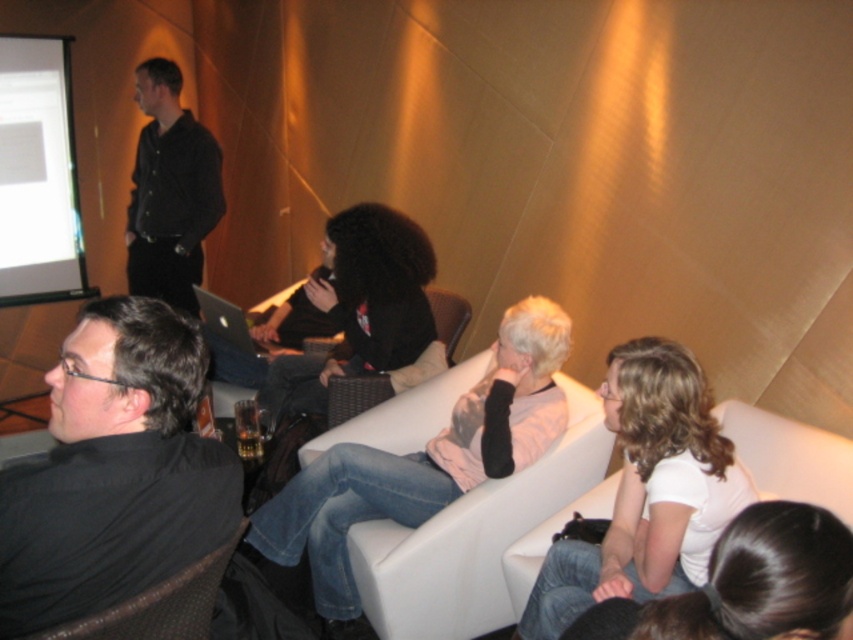
Can you confirm if black matte shirt at lower left is positioned to the right of black matte shirt at center?

In fact, black matte shirt at lower left is to the left of black matte shirt at center.

Which is in front, point (57, 540) or point (364, 273)?

Point (57, 540)

Where is `black matte shirt at lower left`? The width and height of the screenshot is (853, 640). black matte shirt at lower left is located at coordinates (114, 472).

The height and width of the screenshot is (640, 853). What do you see at coordinates (647, 492) in the screenshot? I see `white matte shirt at center` at bounding box center [647, 492].

Is white matte shirt at center to the right of white matte shirt at lower right from the viewer's perspective?

Indeed, white matte shirt at center is positioned on the right side of white matte shirt at lower right.

Does point (635, 465) come behind point (606, 628)?

Yes, it is behind point (606, 628).

You are a GUI agent. You are given a task and a screenshot of the screen. Output one action in this format:
    pyautogui.click(x=<x>, y=<y>)
    Task: Click on the white matte shirt at center
    
    Given the screenshot: What is the action you would take?
    pyautogui.click(x=647, y=492)

What do you see at coordinates (38, 176) in the screenshot? The image size is (853, 640). I see `white glossy projection screen at upper left` at bounding box center [38, 176].

Who is more distant from viewer, (71, 179) or (320, 292)?

Positioned behind is point (71, 179).

Which is behind, point (27, 189) or point (280, 416)?

Positioned behind is point (27, 189).

Where is `white glossy projection screen at upper left`? This screenshot has height=640, width=853. white glossy projection screen at upper left is located at coordinates click(x=38, y=176).